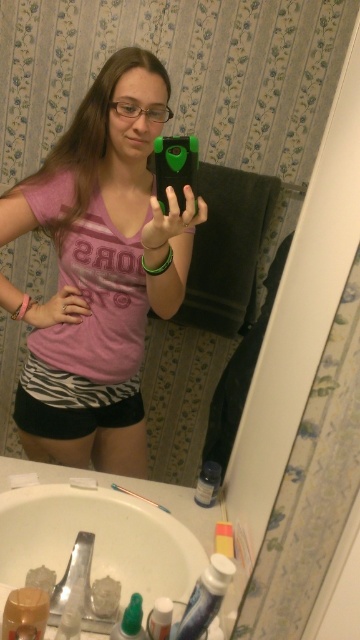
You are a fashion designer observing a person wearing a pink matte shirt at center and zebra print shorts at lower center. Which clothing item is positioned higher on the person?

The pink matte shirt at center is taller than zebra print shorts at lower center, so the pink matte shirt at center is positioned higher on the person.

You are standing in the bathroom and want to take a selfie using the mirror. You notice two points on the mirror surface at coordinates point (74, 440) and point (62, 436). Which point is closer to your face when you look into the mirror?

Point (62, 436) is closer to your face because it is closer to the camera than point (74, 440).